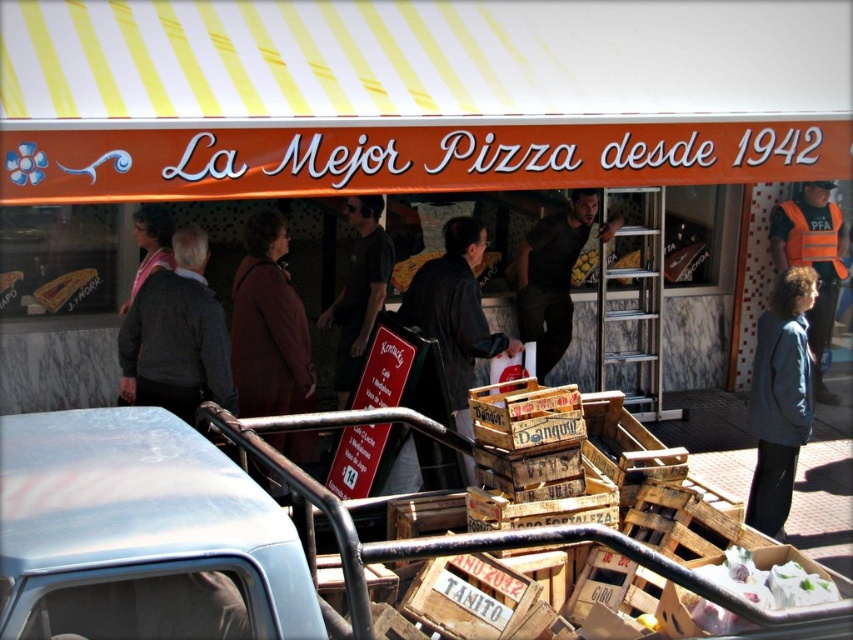
Which is more to the right, dark gray sweater at left or matte gray sweater at left?

dark gray sweater at left is more to the right.

What do you see at coordinates (177, 337) in the screenshot?
I see `dark gray sweater at left` at bounding box center [177, 337].

Locate an element on the screen. This screenshot has width=853, height=640. dark gray sweater at left is located at coordinates pyautogui.click(x=177, y=337).

Does white paper dessert at lower right have a larger size compared to dark gray shirt at center?

Incorrect, white paper dessert at lower right is not larger than dark gray shirt at center.

Which of these two, white paper dessert at lower right or dark gray shirt at center, stands shorter?

white paper dessert at lower right

Who is more forward, (x=723, y=616) or (x=368, y=209)?

Point (x=723, y=616) is in front.

Identify the location of white paper dessert at lower right. (769, 577).

Measure the distance between point (238, 410) and camera.

Point (238, 410) is 5.21 meters away from camera.

Can you confirm if brown wool coat at center is shorter than matte gray sweater at left?

Incorrect, brown wool coat at center's height does not fall short of matte gray sweater at left's.

This screenshot has height=640, width=853. Identify the location of brown wool coat at center. (268, 326).

Locate an element on the screen. This screenshot has width=853, height=640. brown wool coat at center is located at coordinates (268, 326).